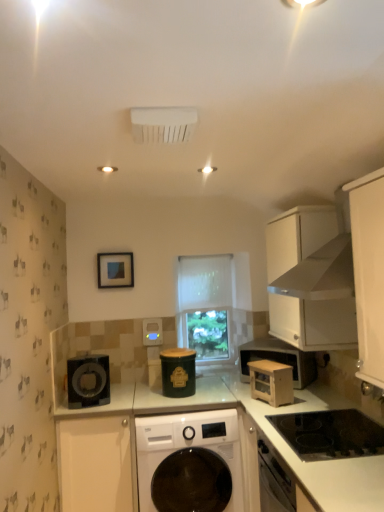
Question: Considering the relative sizes of white matte cabinet at lower left, which is counted as the 2th cabinetry, starting from the top, and wooden microwave at center-right in the image provided, is white matte cabinet at lower left, which is counted as the 2th cabinetry, starting from the top, shorter than wooden microwave at center-right?

Choices:
 (A) no
 (B) yes

Answer: (A)

Question: Does white matte cabinet at lower left, which is counted as the 2th cabinetry, starting from the top, appear on the right side of wooden microwave at center-right?

Choices:
 (A) yes
 (B) no

Answer: (B)

Question: From the image's perspective, is white matte cabinet at lower left, which is counted as the 2th cabinetry, starting from the top, on top of wooden microwave at center-right?

Choices:
 (A) no
 (B) yes

Answer: (A)

Question: Is there a large distance between white matte cabinet at lower left, which is counted as the 2th cabinetry, starting from the top, and wooden microwave at center-right?

Choices:
 (A) yes
 (B) no

Answer: (B)

Question: Considering the relative positions of white matte cabinet at lower left, acting as the 1th cabinetry starting from the bottom, and wooden microwave at center-right in the image provided, is white matte cabinet at lower left, acting as the 1th cabinetry starting from the bottom, in front of wooden microwave at center-right?

Choices:
 (A) yes
 (B) no

Answer: (B)

Question: Based on their sizes in the image, would you say white glossy countertop at lower right is bigger or smaller than white matte cabinet at upper right, which is the second cabinetry in left-to-right order?

Choices:
 (A) small
 (B) big

Answer: (B)

Question: From a real-world perspective, relative to white matte cabinet at upper right, placed as the 2th cabinetry when sorted from bottom to top, is white glossy countertop at lower right vertically above or below?

Choices:
 (A) below
 (B) above

Answer: (A)

Question: Is point 322,502 closer or farther from the camera than point 317,224?

Choices:
 (A) farther
 (B) closer

Answer: (B)

Question: From their relative heights in the image, would you say white glossy countertop at lower right is taller or shorter than white matte cabinet at upper right, acting as the 1th cabinetry starting from the top?

Choices:
 (A) short
 (B) tall

Answer: (B)

Question: Is white plastic air conditioning unit at upper center situated inside green matte canister at center, which ranks as the first appliance in right-to-left order, or outside?

Choices:
 (A) inside
 (B) outside

Answer: (B)

Question: From a real-world perspective, is white plastic air conditioning unit at upper center above or below green matte canister at center, which ranks as the first appliance in right-to-left order?

Choices:
 (A) below
 (B) above

Answer: (B)

Question: From the image's perspective, is white plastic air conditioning unit at upper center positioned above or below green matte canister at center, the 2th appliance when ordered from front to back?

Choices:
 (A) below
 (B) above

Answer: (B)

Question: Considering the positions of white plastic air conditioning unit at upper center and green matte canister at center, which appears as the second appliance when viewed from the back, in the image, is white plastic air conditioning unit at upper center bigger or smaller than green matte canister at center, which appears as the second appliance when viewed from the back,?

Choices:
 (A) big
 (B) small

Answer: (B)

Question: Is point (183, 263) positioned closer to the camera than point (208, 436)?

Choices:
 (A) farther
 (B) closer

Answer: (A)

Question: Is white sheer curtain at center in front of or behind white glossy washing machine at center in the image?

Choices:
 (A) behind
 (B) front

Answer: (A)